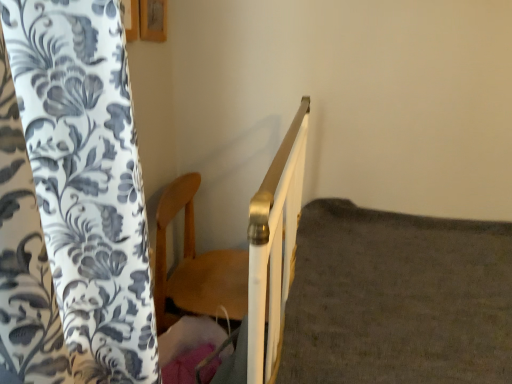
Question: Considering the relative sizes of wooden chair at center and white matte bed frame at upper right in the image provided, is wooden chair at center taller than white matte bed frame at upper right?

Choices:
 (A) yes
 (B) no

Answer: (B)

Question: Is wooden chair at center positioned far away from white matte bed frame at upper right?

Choices:
 (A) no
 (B) yes

Answer: (A)

Question: Are wooden chair at center and white matte bed frame at upper right beside each other?

Choices:
 (A) no
 (B) yes

Answer: (A)

Question: Could you tell me if wooden chair at center is turned towards white matte bed frame at upper right?

Choices:
 (A) no
 (B) yes

Answer: (B)

Question: From a real-world perspective, is wooden chair at center on white matte bed frame at upper right?

Choices:
 (A) yes
 (B) no

Answer: (B)

Question: From the image's perspective, would you say wooden chair at center is shown under white matte bed frame at upper right?

Choices:
 (A) no
 (B) yes

Answer: (A)

Question: Is white matte bed frame at upper right to the left of wooden chair at center from the viewer's perspective?

Choices:
 (A) yes
 (B) no

Answer: (B)

Question: Is white matte bed frame at upper right facing towards wooden chair at center?

Choices:
 (A) no
 (B) yes

Answer: (A)

Question: From the image's perspective, is white matte bed frame at upper right beneath wooden chair at center?

Choices:
 (A) no
 (B) yes

Answer: (B)

Question: Does white matte bed frame at upper right have a larger size compared to wooden chair at center?

Choices:
 (A) no
 (B) yes

Answer: (B)

Question: Is white matte bed frame at upper right closer to camera compared to wooden chair at center?

Choices:
 (A) yes
 (B) no

Answer: (A)

Question: Does white matte bed frame at upper right have a greater height compared to wooden chair at center?

Choices:
 (A) no
 (B) yes

Answer: (B)

Question: Is white matte bed frame at upper right inside the boundaries of wooden chair at center, or outside?

Choices:
 (A) outside
 (B) inside

Answer: (A)